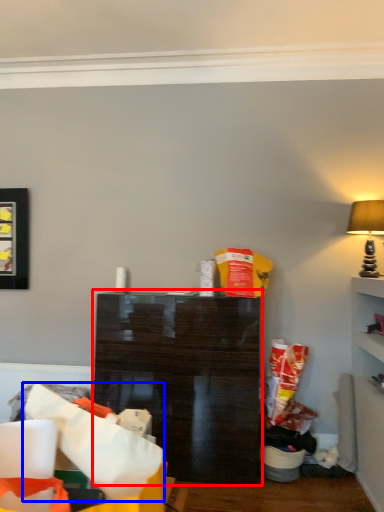
Question: Which of the following is the farthest to the observer, shelf (highlighted by a red box) or paper bag (highlighted by a blue box)?

Choices:
 (A) shelf
 (B) paper bag

Answer: (A)